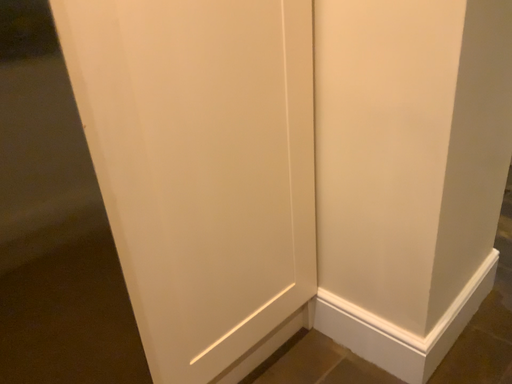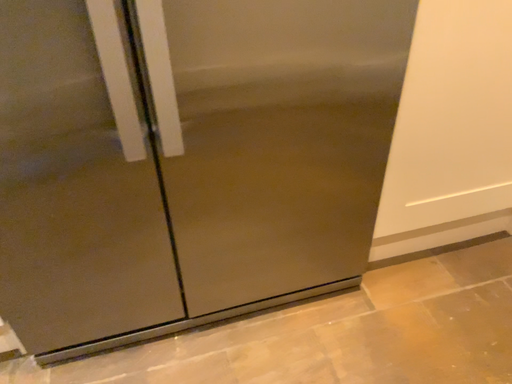
Question: Which way did the camera rotate in the video?

Choices:
 (A) rotated left
 (B) rotated right

Answer: (A)